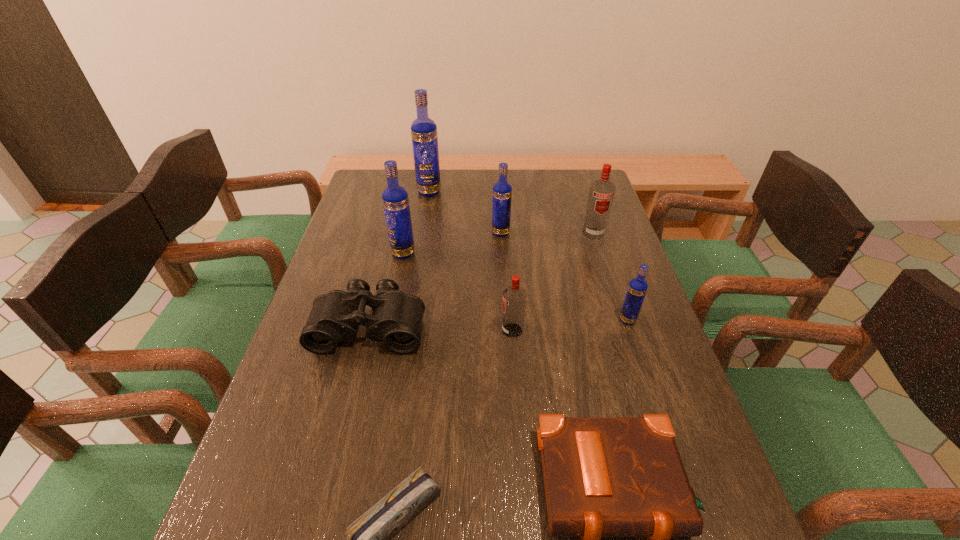
Locate an element on the screen. The height and width of the screenshot is (540, 960). the farthest blue vodka is located at coordinates (424, 136).

Locate an element on the screen. The image size is (960, 540). the biggest blue vodka is located at coordinates (424, 136).

What are the coordinates of `the sixth nearest object` in the screenshot? It's located at pos(395,199).

You are a GUI agent. You are given a task and a screenshot of the screen. Output one action in this format:
    pyautogui.click(x=<x>, y=<y>)
    Task: Click on the second biggest blue vodka
    Image resolution: width=960 pixels, height=540 pixels.
    Given the screenshot: What is the action you would take?
    [x=395, y=199]

Locate an element on the screen. the second farthest blue vodka is located at coordinates (502, 191).

The height and width of the screenshot is (540, 960). Find the location of `the second smallest blue vodka`. the second smallest blue vodka is located at coordinates (502, 191).

Identify the location of the bigger red vodka. This screenshot has width=960, height=540. (601, 194).

Identify the location of the right red vodka. The image size is (960, 540). (601, 194).

Locate an element on the screen. This screenshot has height=540, width=960. the nearer red vodka is located at coordinates (514, 297).

Find the location of a particular element. This screenshot has height=540, width=960. the left red vodka is located at coordinates (514, 297).